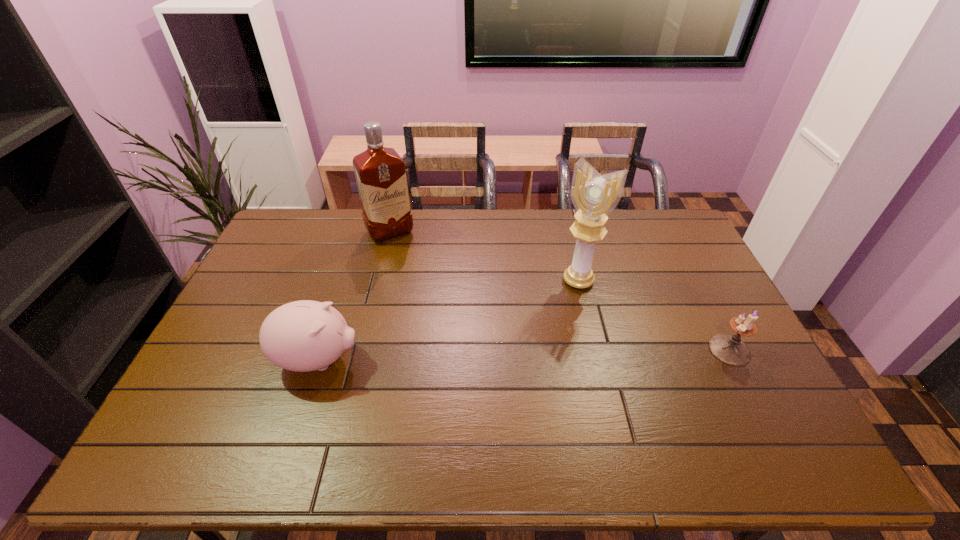
Image resolution: width=960 pixels, height=540 pixels. Find the location of `free spot located 0.140m on the front-facing side of the award`. free spot located 0.140m on the front-facing side of the award is located at coordinates pos(551,319).

The height and width of the screenshot is (540, 960). In order to click on blank space located 0.350m on the front-facing side of the award in this screenshot , I will do `click(518, 367)`.

Locate an element on the screen. The height and width of the screenshot is (540, 960). vacant area located 0.060m on the front-facing side of the award is located at coordinates coord(562,302).

Locate an element on the screen. The width and height of the screenshot is (960, 540). object positioned at the far edge is located at coordinates (380, 172).

Locate an element on the screen. The image size is (960, 540). object at the right edge is located at coordinates (729, 349).

Image resolution: width=960 pixels, height=540 pixels. In order to click on vacant space at the far edge of the desktop in this screenshot , I will do `click(475, 232)`.

In the image, there is a desktop. Where is `vacant space at the near edge`? vacant space at the near edge is located at coordinates (636, 392).

In the image, there is a desktop. Where is `vacant space at the left edge`? vacant space at the left edge is located at coordinates (288, 253).

The height and width of the screenshot is (540, 960). In the image, there is a desktop. Find the location of `vacant space at the far right corner`. vacant space at the far right corner is located at coordinates pyautogui.click(x=645, y=217).

Find the location of a particular element. The height and width of the screenshot is (540, 960). unoccupied position between the third object from left to right and the liquor is located at coordinates coord(484,256).